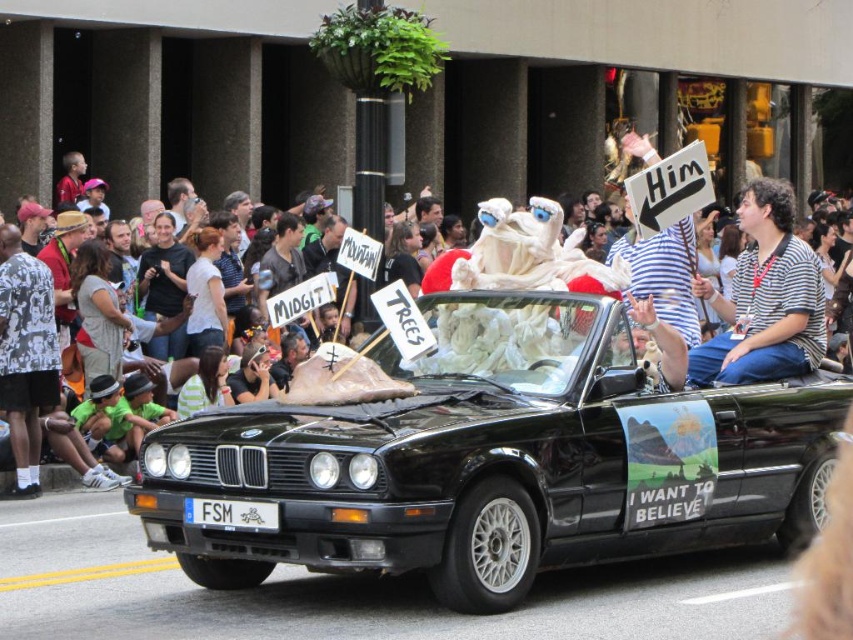
Is striped shirt at center thinner than white cotton crowd at center?

Yes, striped shirt at center is thinner than white cotton crowd at center.

Which is in front, point (729, 333) or point (67, 483)?

Point (729, 333)

Locate an element on the screen. The width and height of the screenshot is (853, 640). striped shirt at center is located at coordinates (764, 298).

Image resolution: width=853 pixels, height=640 pixels. Identify the location of striped shirt at center. (764, 298).

Who is more forward, (x=253, y=500) or (x=701, y=256)?

Point (x=253, y=500) is in front.

Can you confirm if white plastic fsm at center is positioned above white cotton crowd at center?

No.

Between point (268, 506) and point (64, 468), which one is positioned behind?

Positioned behind is point (64, 468).

This screenshot has height=640, width=853. I want to click on white plastic fsm at center, so click(x=231, y=515).

Is black matte convertible at center shorter than white plastic fsm at center?

In fact, black matte convertible at center may be taller than white plastic fsm at center.

Consider the image. Is black matte convertible at center smaller than white plastic fsm at center?

Actually, black matte convertible at center might be larger than white plastic fsm at center.

I want to click on black matte convertible at center, so click(x=498, y=461).

You are a GUI agent. You are given a task and a screenshot of the screen. Output one action in this format:
    pyautogui.click(x=<x>, y=<y>)
    Task: Click on the black matte convertible at center
    The image size is (853, 640).
    Given the screenshot: What is the action you would take?
    pyautogui.click(x=498, y=461)